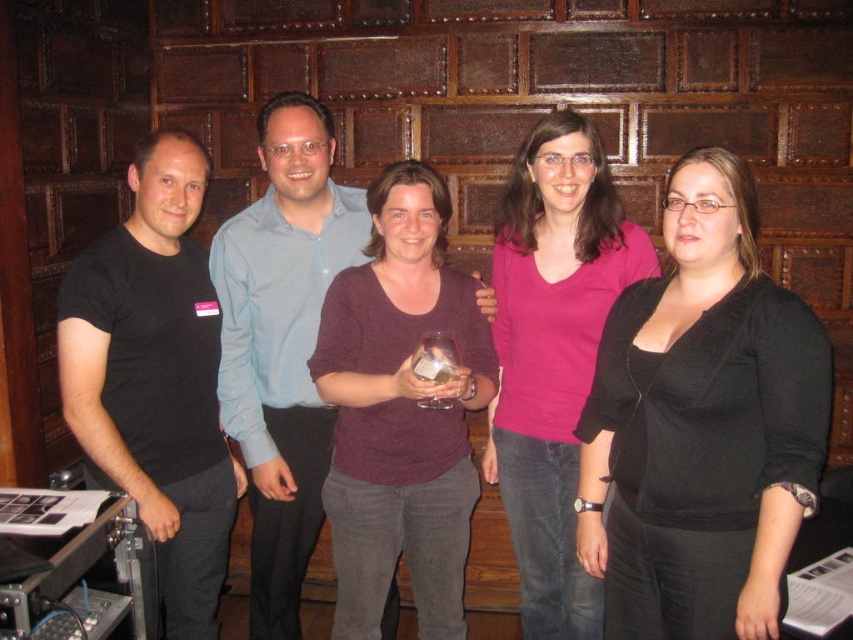
You are standing in the room where the five people are posing for a photo. You want to place a small decoration exactly at the point labeled point [672,586]. If you are 6 feet tall, will the decoration be visible to you without bending down?

The point [672,586] is 5.45 feet away from you. Since you are 6 feet tall, the decoration placed at this point will be visible without bending down as it is within your line of sight.

You are a photographer arranging a group photo. You have two central figures wearing a maroon sweater at center and a pink matte shirt at center. Which of these two is positioned to the left?

The maroon sweater at center is to the left of the pink matte shirt at center.